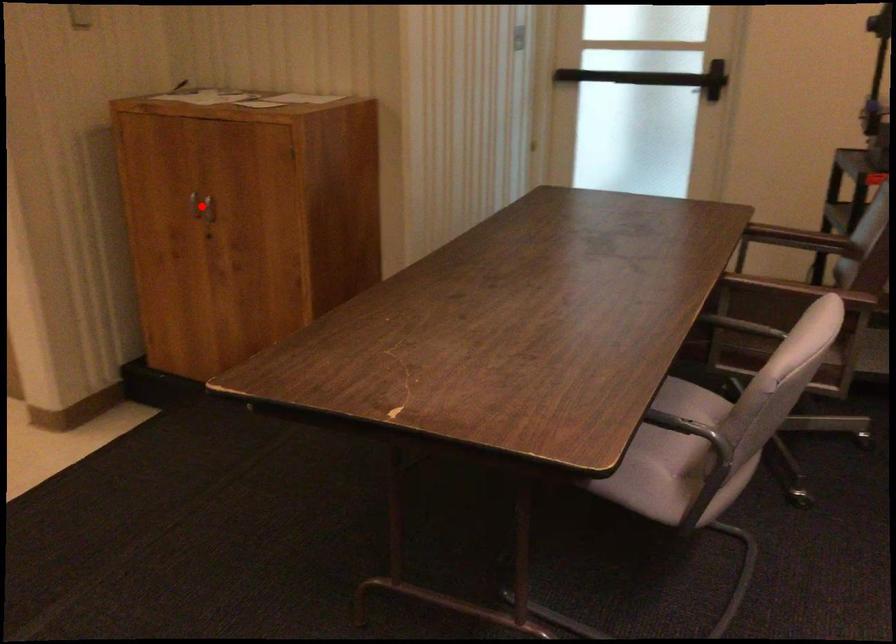
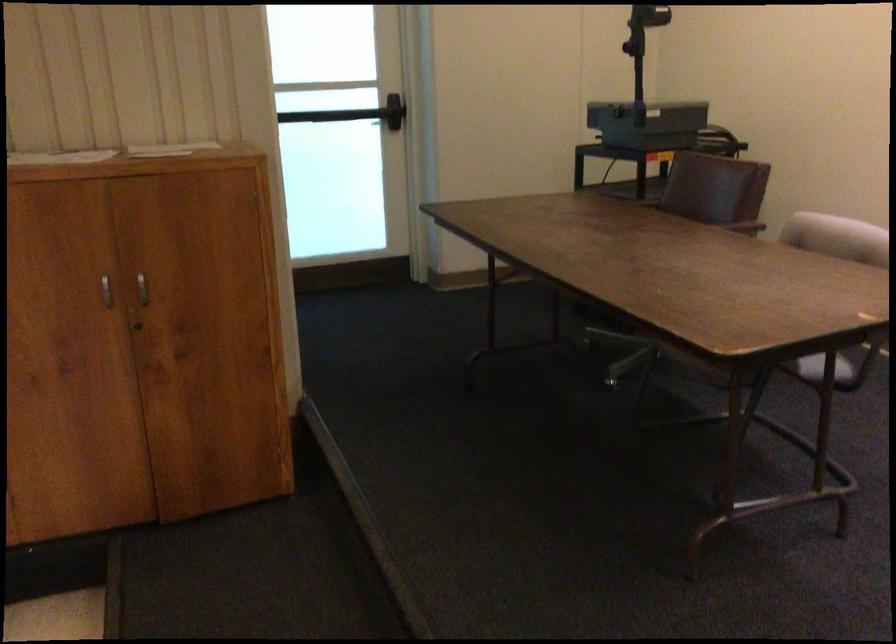
In the second image, find the point that corresponds to the highlighted location in the first image.

(142, 289)